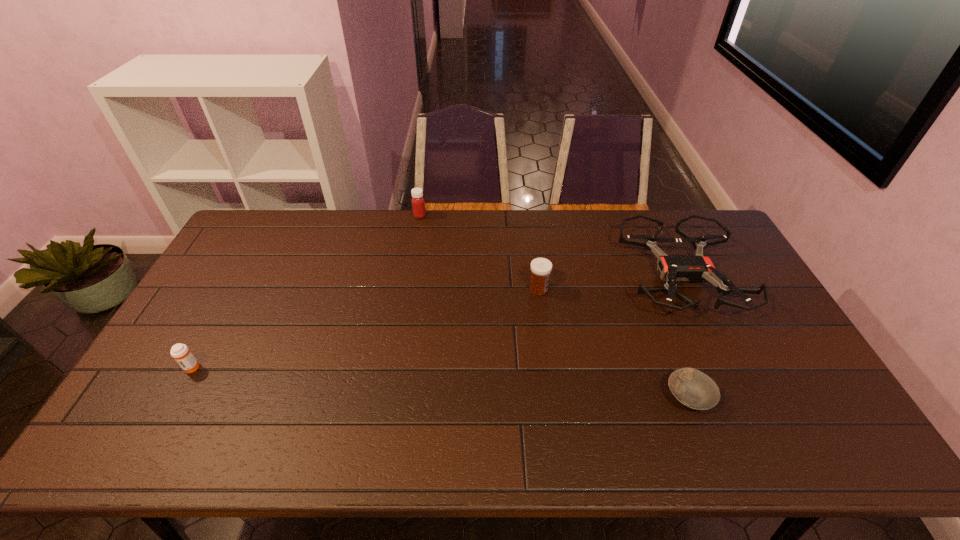
At what (x,y) coordinates should I click in order to perform the action: click on vacant space in between the nearest object and the shortest medicine. Please return your answer as a coordinate pair (x, y). Image resolution: width=960 pixels, height=540 pixels. Looking at the image, I should click on click(x=440, y=382).

Locate an element on the screen. The image size is (960, 540). vacant space that's between the drone and the fourth object from right to left is located at coordinates (550, 247).

Locate an element on the screen. Image resolution: width=960 pixels, height=540 pixels. vacant area that lies between the fourth farthest object and the third object from right to left is located at coordinates (365, 328).

Locate an element on the screen. This screenshot has height=540, width=960. vacant space in between the farthest object and the nearest medicine is located at coordinates (305, 292).

Locate which object ranks third in proximity to the leftmost object. Please provide its 2D coordinates. Your answer should be formatted as a tuple, i.e. [(x, y)], where the tuple contains the x and y coordinates of a point satisfying the conditions above.

[(695, 390)]

The image size is (960, 540). Identify the location of object that ranks as the second closest to the second nearest medicine. (695, 390).

Identify which medicine is the third closest to the drone. Please provide its 2D coordinates. Your answer should be formatted as a tuple, i.e. [(x, y)], where the tuple contains the x and y coordinates of a point satisfying the conditions above.

[(180, 352)]

Find the location of `medicine that is the closest one to the second farthest medicine`. medicine that is the closest one to the second farthest medicine is located at coordinates (418, 203).

The image size is (960, 540). I want to click on blank space that satisfies the following two spatial constraints: 1. on the front side of the second object from left to right; 2. on the right side of the nearest object, so 390,397.